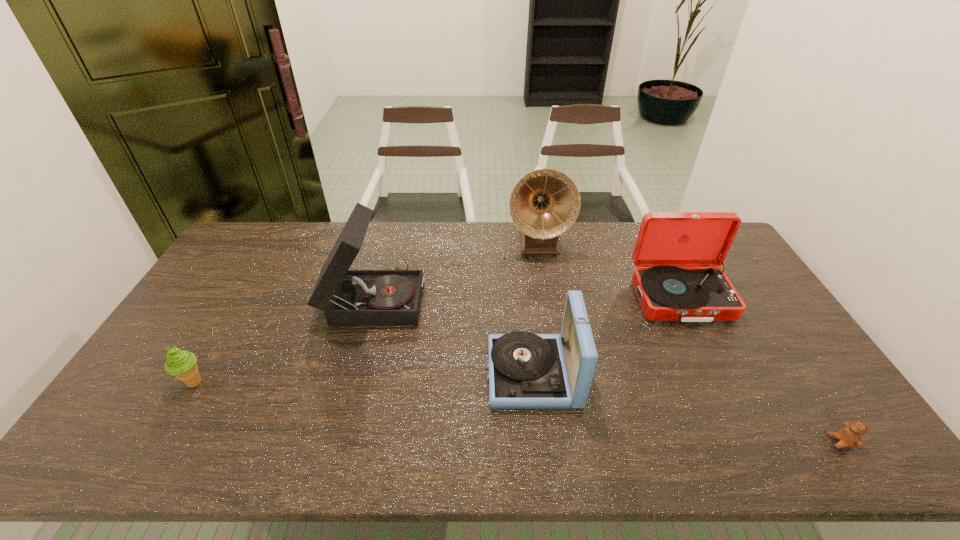
Identify the location of the farthest phonograph record. Image resolution: width=960 pixels, height=540 pixels. (545, 203).

Image resolution: width=960 pixels, height=540 pixels. I want to click on the fifth object from right to left, so click(x=348, y=297).

Find the location of a particular element. This screenshot has width=960, height=540. the rightmost phonograph record is located at coordinates (666, 241).

Locate an element on the screen. the second object from right to left is located at coordinates click(x=666, y=241).

The image size is (960, 540). I want to click on the shortest phonograph record, so click(x=525, y=370).

In order to click on the third shortest object in this screenshot , I will do `click(525, 370)`.

The width and height of the screenshot is (960, 540). In order to click on icecream in this screenshot , I will do `click(182, 364)`.

Locate an element on the screen. The width and height of the screenshot is (960, 540). the second shortest object is located at coordinates (182, 364).

At what (x,y) coordinates should I click in order to perform the action: click on the nearest object. Please return your answer as a coordinate pair (x, y). This screenshot has width=960, height=540. Looking at the image, I should click on (851, 435).

In order to click on the rightmost object in this screenshot , I will do `click(851, 435)`.